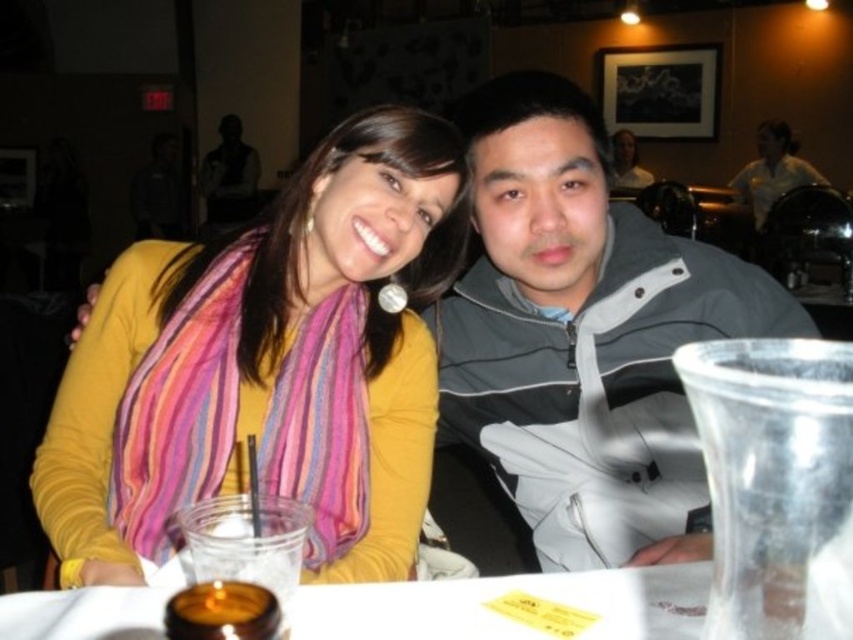
Question: Among these points, which one is nearest to the camera?

Choices:
 (A) (466, 625)
 (B) (233, 193)
 (C) (283, 483)

Answer: (A)

Question: Is multicolored silky scarf at center bigger than dark gray vest at upper left?

Choices:
 (A) no
 (B) yes

Answer: (A)

Question: Can you confirm if gray matte jacket at center is thinner than white paper table at center?

Choices:
 (A) yes
 (B) no

Answer: (A)

Question: Which point appears closest to the camera in this image?

Choices:
 (A) (215, 221)
 (B) (492, 592)
 (C) (56, 433)

Answer: (B)

Question: Can you confirm if white paper table at center is smaller than dark gray vest at upper left?

Choices:
 (A) no
 (B) yes

Answer: (B)

Question: Estimate the real-world distances between objects in this image. Which object is closer to the white paper table at center?

Choices:
 (A) multicolored silky scarf at center
 (B) gray matte jacket at center
 (C) yellow matte scarf at upper left

Answer: (A)